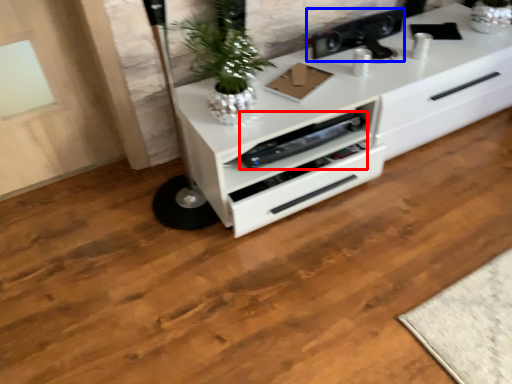
Question: Which point is closer to the camera, appliance (highlighted by a red box) or appliance (highlighted by a blue box)?

Choices:
 (A) appliance
 (B) appliance

Answer: (A)